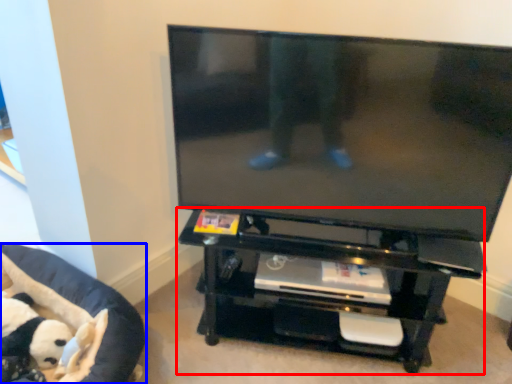
Question: Among these objects, which one is farthest to the camera, entertainment center (highlighted by a red box) or furniture (highlighted by a blue box)?

Choices:
 (A) entertainment center
 (B) furniture

Answer: (A)